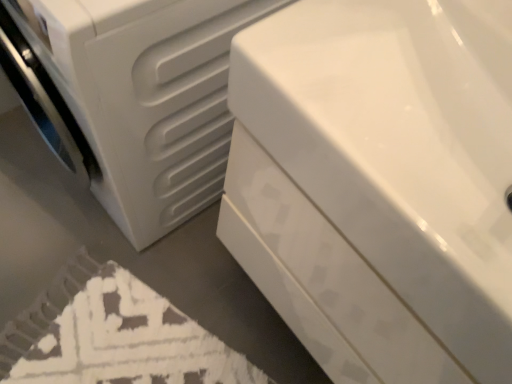
Question: Is white textured bath mat at lower left to the left of white matte washing machine at left from the viewer's perspective?

Choices:
 (A) no
 (B) yes

Answer: (B)

Question: Is white matte washing machine at left a part of white textured bath mat at lower left?

Choices:
 (A) no
 (B) yes

Answer: (A)

Question: Is white textured bath mat at lower left oriented away from white matte washing machine at left?

Choices:
 (A) yes
 (B) no

Answer: (B)

Question: Can you confirm if white textured bath mat at lower left is wider than white matte washing machine at left?

Choices:
 (A) yes
 (B) no

Answer: (A)

Question: From a real-world perspective, is white textured bath mat at lower left physically above white matte washing machine at left?

Choices:
 (A) no
 (B) yes

Answer: (A)

Question: Does point [x=131, y=96] appear closer or farther from the camera than point [x=370, y=248]?

Choices:
 (A) closer
 (B) farther

Answer: (B)

Question: In the image, is white matte washing machine at left positioned in front of or behind white glossy bathtub at center?

Choices:
 (A) behind
 (B) front

Answer: (A)

Question: In terms of size, does white matte washing machine at left appear bigger or smaller than white glossy bathtub at center?

Choices:
 (A) small
 (B) big

Answer: (B)

Question: From the image's perspective, is white matte washing machine at left positioned above or below white glossy bathtub at center?

Choices:
 (A) above
 (B) below

Answer: (A)

Question: Looking at their shapes, would you say white glossy bathtub at center is wider or thinner than white matte washing machine at left?

Choices:
 (A) thin
 (B) wide

Answer: (A)

Question: Considering the positions of white glossy bathtub at center and white matte washing machine at left in the image, is white glossy bathtub at center taller or shorter than white matte washing machine at left?

Choices:
 (A) tall
 (B) short

Answer: (B)

Question: Considering their positions, is white glossy bathtub at center located in front of or behind white matte washing machine at left?

Choices:
 (A) front
 (B) behind

Answer: (A)

Question: Does point (493, 175) appear closer or farther from the camera than point (32, 1)?

Choices:
 (A) closer
 (B) farther

Answer: (B)

Question: In terms of width, does white glossy bathtub at center look wider or thinner when compared to white textured bath mat at lower left?

Choices:
 (A) wide
 (B) thin

Answer: (B)

Question: Would you say white glossy bathtub at center is to the left or to the right of white textured bath mat at lower left in the picture?

Choices:
 (A) right
 (B) left

Answer: (A)